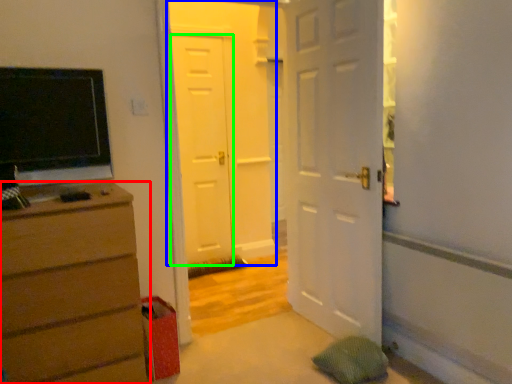
Question: Which object is positioned closest to chest of drawers (highlighted by a red box)? Select from door (highlighted by a blue box) and door (highlighted by a green box).

Choices:
 (A) door
 (B) door

Answer: (B)